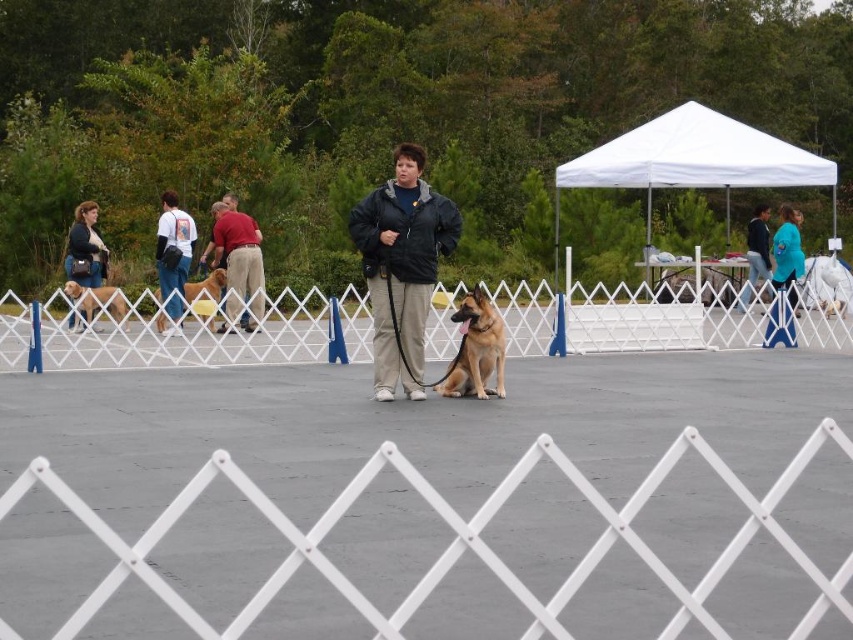
From the picture: You are a photographer positioned at the back of the scene. You want to take a photo of the black matte jacket at center and the white plastic fence at center without any obstructions. Based on their positions, which object should you focus on first to ensure both are in the frame?

The white plastic fence at center is below the black matte jacket at center, so you should focus on the black matte jacket at center first to ensure both are in the frame.

You are a photographer trying to capture a group photo of the handler and the German Shepherd. The black matte jacket at center and the white fabric canopy at upper right are both in the frame. Considering their sizes, which object should you focus on to ensure both are clearly visible in the photo?

The black matte jacket at center is smaller in width than the white fabric canopy at upper right, so focusing on the black matte jacket at center would allow both objects to be clearly visible as it is closer and smaller.

You are a photographer trying to capture a clear shot of the black matte jacket at center and the white plastic fence at center. Based on their heights, will the fence obscure the jacket in the photo?

The white plastic fence at center is much taller than the black matte jacket at center, so the fence will likely obscure the jacket in the photo.